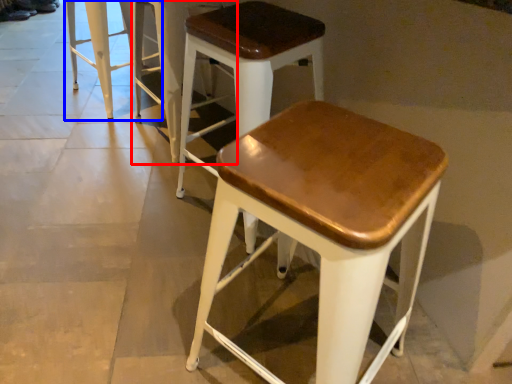
Question: Among these objects, which one is nearest to the camera, stool (highlighted by a red box) or stool (highlighted by a blue box)?

Choices:
 (A) stool
 (B) stool

Answer: (A)